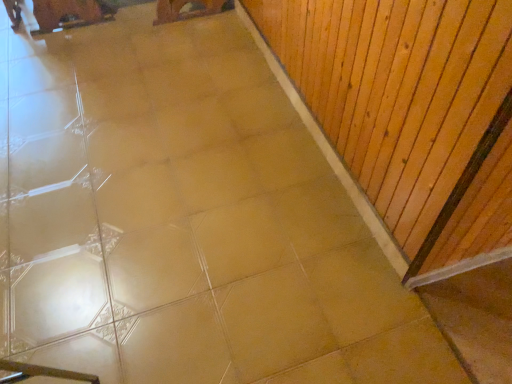
Where is `free space to the left of natural wood plywood at upper right`? The height and width of the screenshot is (384, 512). free space to the left of natural wood plywood at upper right is located at coordinates (154, 109).